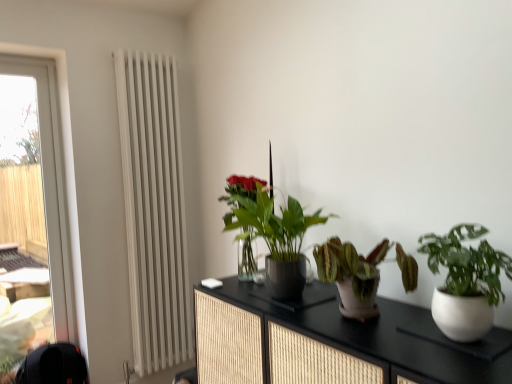
Locate an element on the screen. free region under white matte pot at right, the 4th houseplant viewed from the back (from a real-world perspective) is located at coordinates (463, 336).